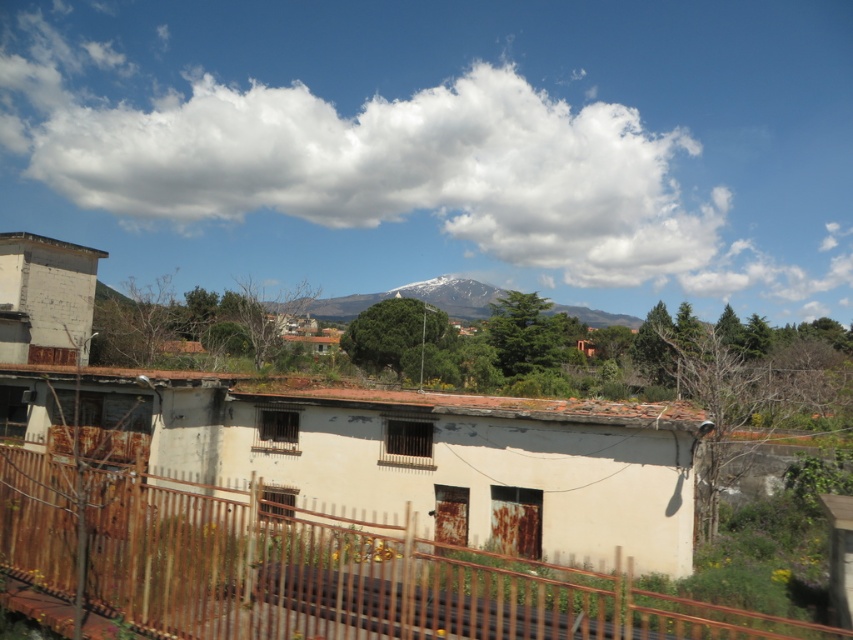
Can you confirm if white fluffy cloud at upper center is positioned below snowy white mountain at center?

Incorrect, white fluffy cloud at upper center is not positioned below snowy white mountain at center.

The height and width of the screenshot is (640, 853). Describe the element at coordinates (444, 145) in the screenshot. I see `white fluffy cloud at upper center` at that location.

Identify the location of white fluffy cloud at upper center. (444, 145).

Is point (309, 524) positioned in front of point (357, 308)?

Yes, point (309, 524) is closer to viewer.

Is rusty metal fence at lower center to the left of snowy white mountain at center from the viewer's perspective?

Incorrect, rusty metal fence at lower center is not on the left side of snowy white mountain at center.

Is point (544, 582) closer to camera compared to point (440, 298)?

Yes, point (544, 582) is in front of point (440, 298).

Where is `rusty metal fence at lower center`? This screenshot has width=853, height=640. rusty metal fence at lower center is located at coordinates (357, 577).

Can you confirm if white fluffy cloud at upper center is positioned to the right of rusty metal fence at lower center?

Incorrect, white fluffy cloud at upper center is not on the right side of rusty metal fence at lower center.

Is white fluffy cloud at upper center bigger than rusty metal fence at lower center?

Correct, white fluffy cloud at upper center is larger in size than rusty metal fence at lower center.

Who is more distant from viewer, (x=281, y=212) or (x=659, y=625)?

The point (x=281, y=212) is behind.

You are a GUI agent. You are given a task and a screenshot of the screen. Output one action in this format:
    pyautogui.click(x=<x>, y=<y>)
    Task: Click on the white fluffy cloud at upper center
    
    Given the screenshot: What is the action you would take?
    pyautogui.click(x=444, y=145)